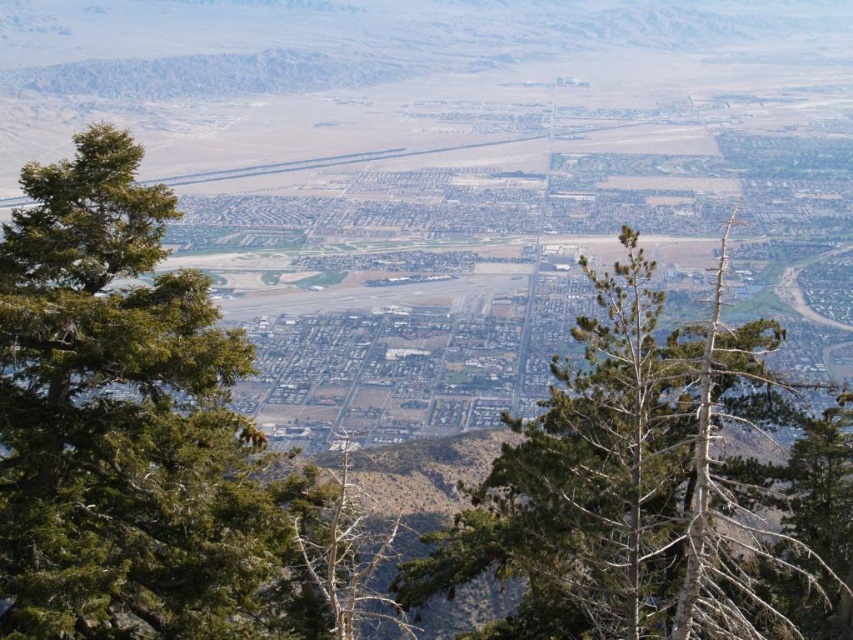
Is green needle-like tree at center thinner than bare wood tree at center?

Yes.

Is point (59, 321) less distant than point (341, 609)?

Yes, point (59, 321) is in front of point (341, 609).

Does point (86, 285) come in front of point (349, 532)?

Yes, point (86, 285) is closer to viewer.

Locate an element on the screen. This screenshot has height=640, width=853. green needle-like tree at center is located at coordinates (125, 426).

Is green leafy tree at center positioned behind bare wood tree at center?

No, it is not.

At what (x,y) coordinates should I click in order to perform the action: click on green leafy tree at center. Please return your answer as a coordinate pair (x, y). Looking at the image, I should click on (634, 484).

Is the position of green needle-like tree at center more distant than that of green leafy tree at center?

No.

Describe the element at coordinates (125, 426) in the screenshot. The height and width of the screenshot is (640, 853). I see `green needle-like tree at center` at that location.

This screenshot has width=853, height=640. I want to click on green needle-like tree at center, so click(x=125, y=426).